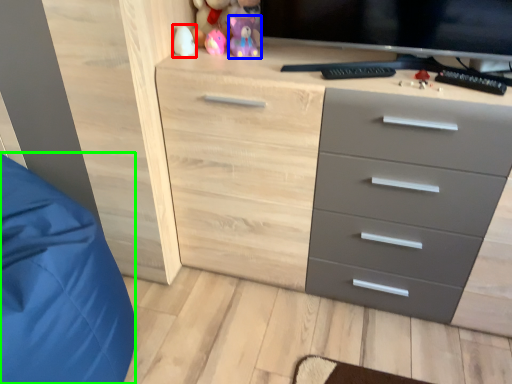
Question: Based on their relative distances, which object is nearer to toy (highlighted by a red box)? Choose from toy (highlighted by a blue box) and sleeping bag (highlighted by a green box).

Choices:
 (A) toy
 (B) sleeping bag

Answer: (A)